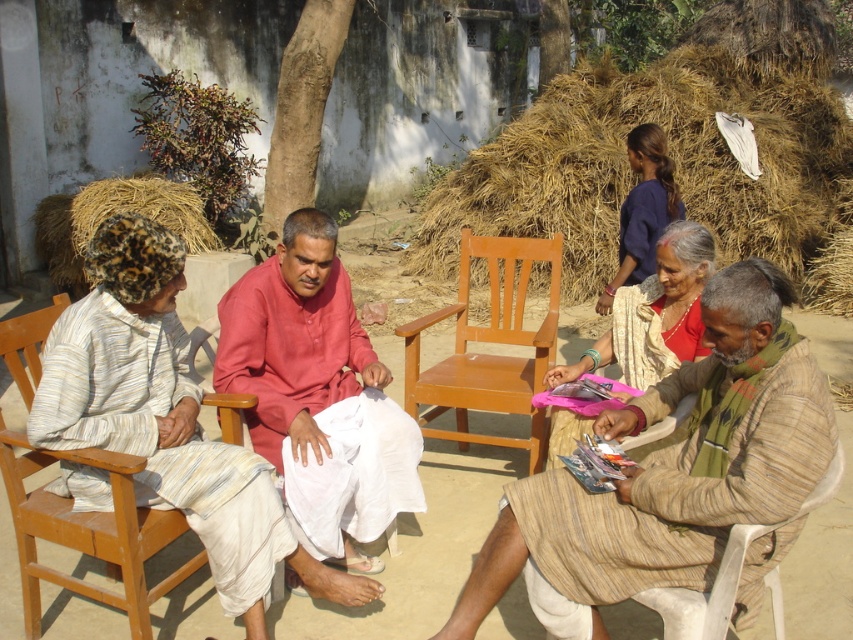
You are standing at the point labeled as point (674, 182) and want to walk towards the point labeled as point (340, 301). Which direction should you face to move towards your destination?

You should face forward because point (340, 301) is in front of point (674, 182).

You are organizing a small gathering and need to decide seating arrangements. You have a wooden chair at center and a blue fabric saree at upper right. Which object can accommodate more people?

The wooden chair at center is bigger than the blue fabric saree at upper right, so it can accommodate more people.